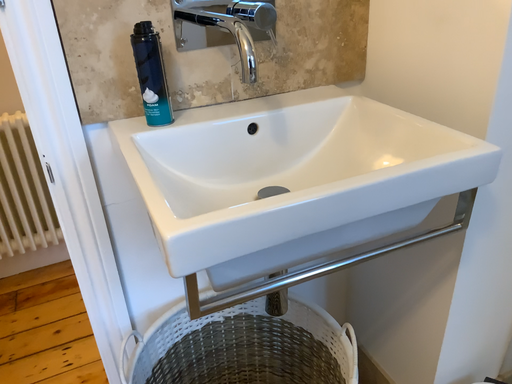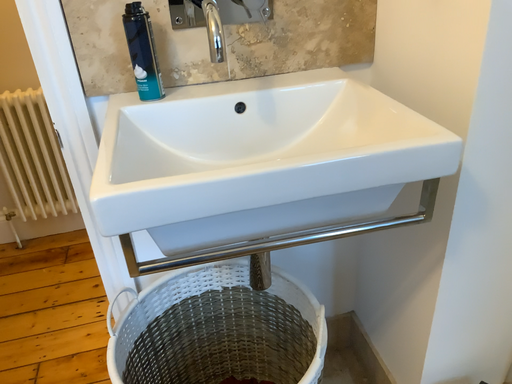
Question: Which way did the camera rotate in the video?

Choices:
 (A) rotated left
 (B) rotated right

Answer: (A)